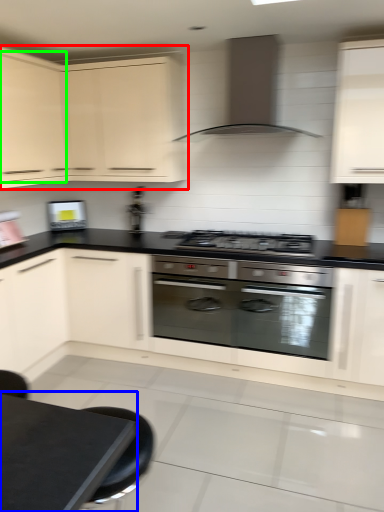
Question: Considering the real-world distances, which object is closest to cabinetry (highlighted by a red box)? table (highlighted by a blue box) or cabinetry (highlighted by a green box).

Choices:
 (A) table
 (B) cabinetry

Answer: (B)